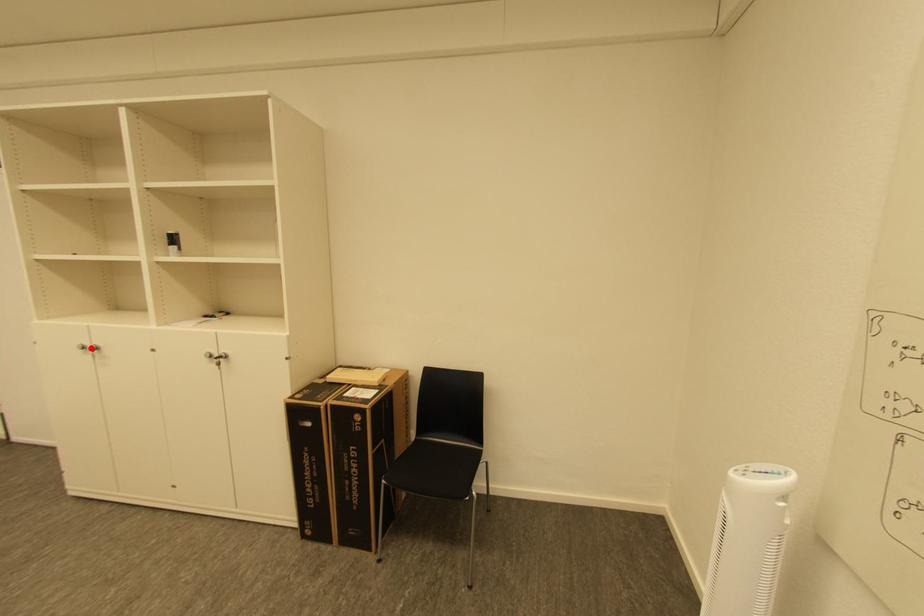
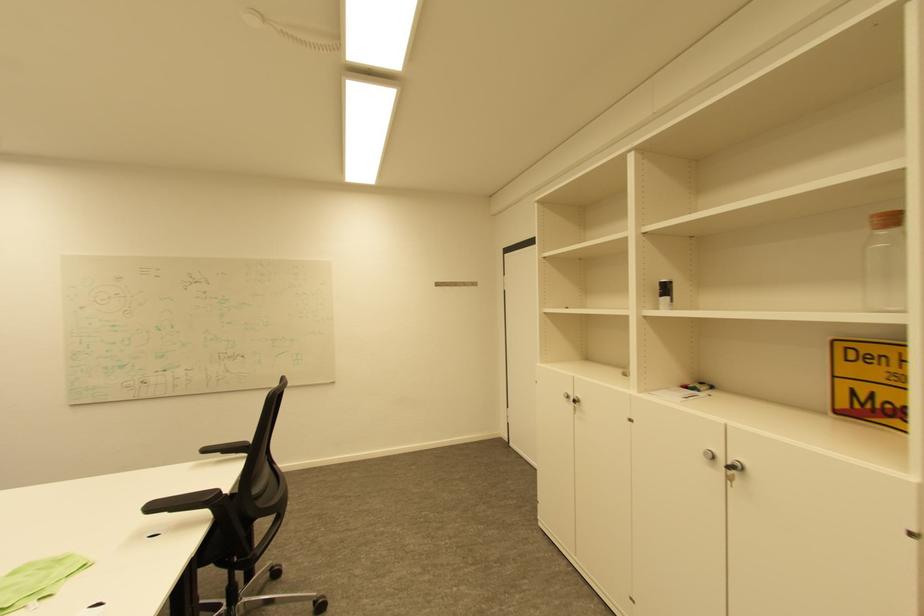
Question: I am providing you with two images of the same scene from different viewpoints. A red point is marked on the first image. Can you still see the location of the red point in image 2?

Choices:
 (A) Yes
 (B) No

Answer: (A)